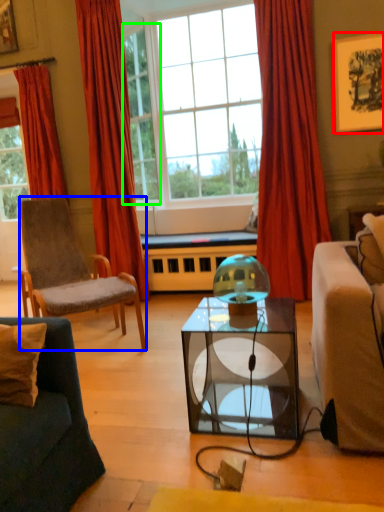
Question: Which object is the farthest from picture frame (highlighted by a red box)? Choose among these: chair (highlighted by a blue box) or window (highlighted by a green box).

Choices:
 (A) chair
 (B) window

Answer: (A)